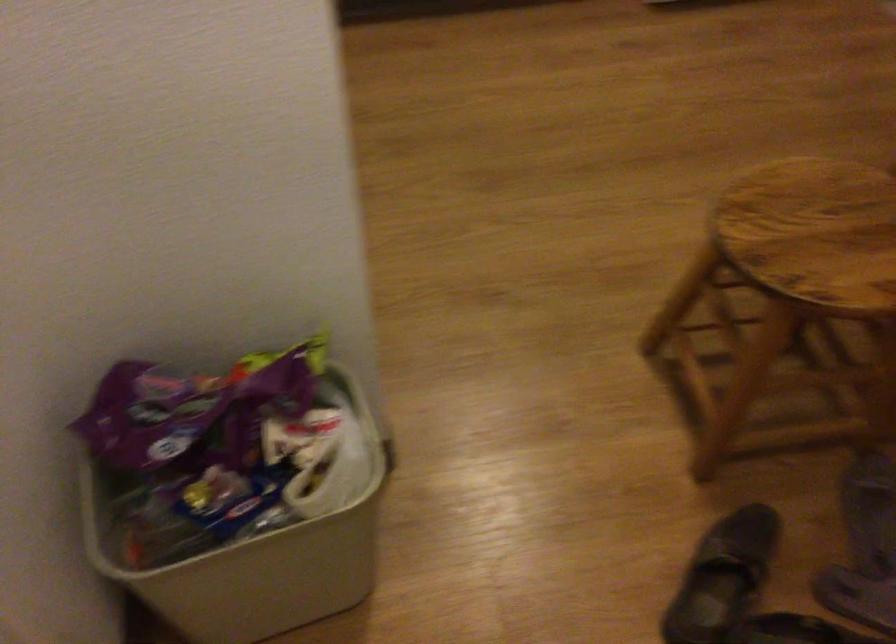
I want to click on chair sitting surface, so click(814, 232).